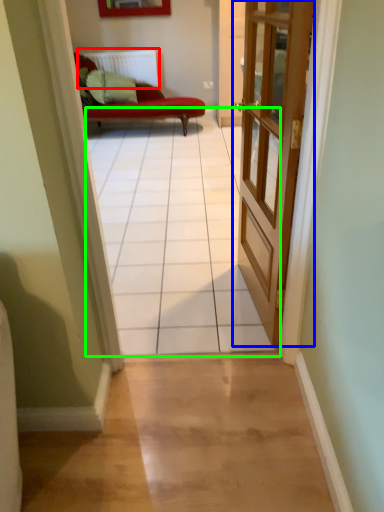
Question: Which object is the closest to the radiator (highlighted by a red box)? Choose among these: door (highlighted by a blue box) or path (highlighted by a green box).

Choices:
 (A) door
 (B) path

Answer: (B)